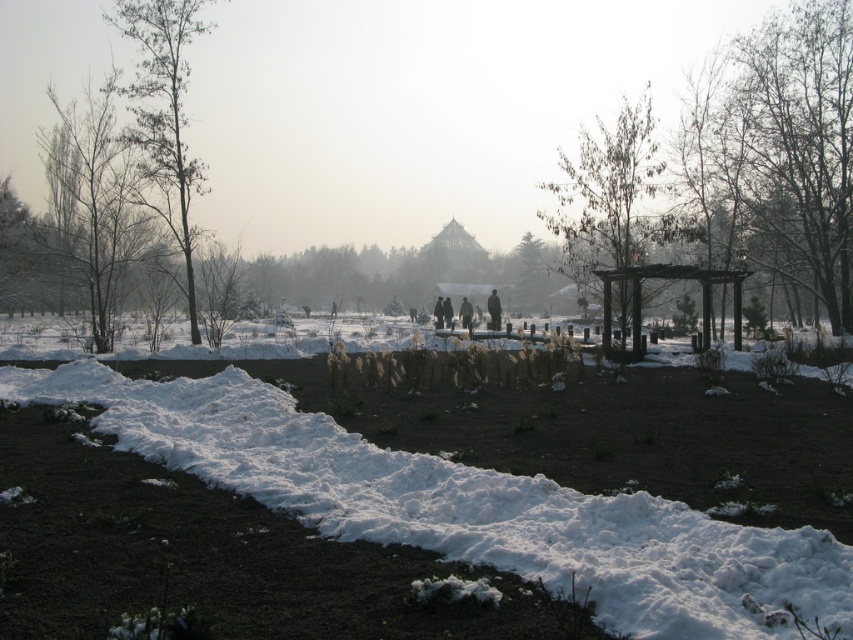
Question: Which of the following is the closest to the observer?

Choices:
 (A) (465, 304)
 (B) (193, 29)
 (C) (200, 444)
 (D) (498, 320)

Answer: (C)

Question: Can you confirm if snow-covered tree at left is positioned to the right of black matte person at center?

Choices:
 (A) yes
 (B) no

Answer: (B)

Question: Which point is farther to the camera?

Choices:
 (A) bare wood tree at left
 (B) brown wooden gazebo at center
 (C) black matte person at center
 (D) dark gray fabric coat at center

Answer: (C)

Question: Can you confirm if bare wood tree at left is bigger than dark gray fabric coat at center?

Choices:
 (A) yes
 (B) no

Answer: (A)

Question: Estimate the real-world distances between objects in this image. Which object is closer to the bare wood tree at left?

Choices:
 (A) brown wooden gazebo at center
 (B) green matte tree at center
 (C) snow-covered tree at left

Answer: (C)

Question: Is white fluffy snow at lower left above brown wooden gazebo at center?

Choices:
 (A) yes
 (B) no

Answer: (B)